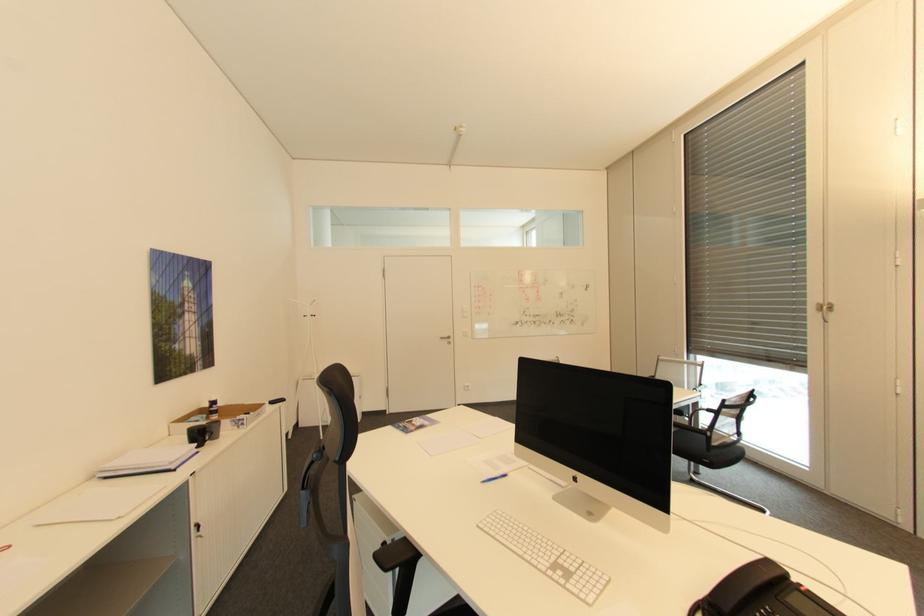
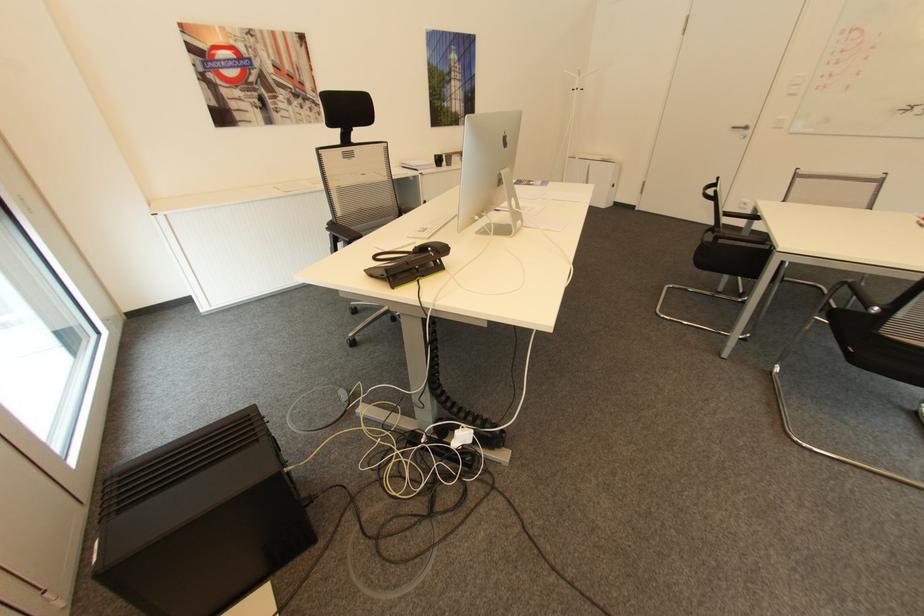
In the second image, find the point that corresponds to pixel 454 337 in the first image.

(749, 128)